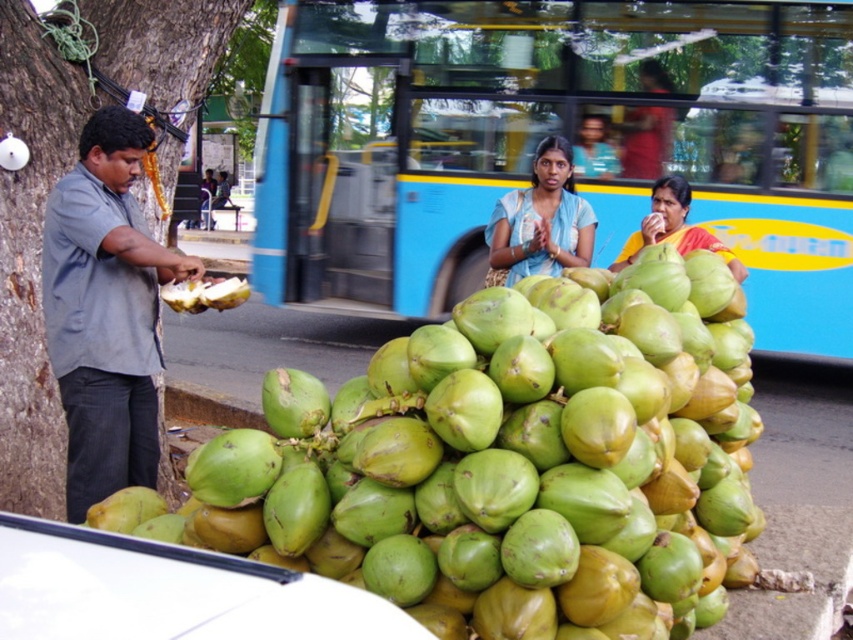
Question: Is green matte coconut at center to the left of gray shirt at left from the viewer's perspective?

Choices:
 (A) no
 (B) yes

Answer: (A)

Question: Which object is positioned farthest from the gray shirt at left?

Choices:
 (A) blue fabric woman at center
 (B) blue painted bus at center

Answer: (B)

Question: Which of the following is the closest to the observer?

Choices:
 (A) gray shirt at left
 (B) green matte coconut at center

Answer: (B)

Question: Can you confirm if blue painted bus at center is positioned above blue fabric woman at center?

Choices:
 (A) no
 (B) yes

Answer: (B)

Question: Is blue painted bus at center to the right of white matte coconut at center from the viewer's perspective?

Choices:
 (A) yes
 (B) no

Answer: (A)

Question: Which point is closer to the camera?

Choices:
 (A) (582, 468)
 (B) (73, 192)

Answer: (A)